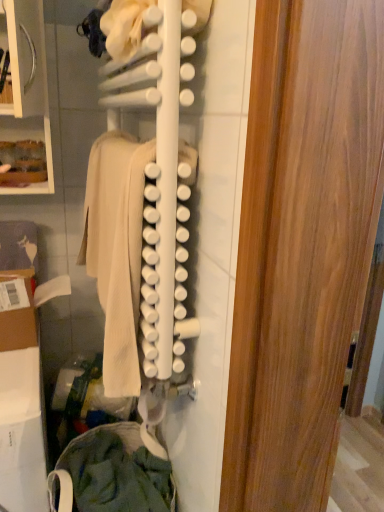
Question: Considering the positions of point (104, 170) and point (145, 461), is point (104, 170) closer or farther from the camera than point (145, 461)?

Choices:
 (A) closer
 (B) farther

Answer: (A)

Question: From a real-world perspective, relative to green cotton pants at lower left, the second clothing from the top, is white matte rack at center vertically above or below?

Choices:
 (A) below
 (B) above

Answer: (B)

Question: Which of these objects is positioned farthest from the green cotton pants at lower left, the first clothing ordered from the bottom?

Choices:
 (A) white matte rack at center
 (B) beige wool sweater at center, which ranks as the second clothing in bottom-to-top order

Answer: (A)

Question: Estimate the real-world distances between objects in this image. Which object is closer to the beige wool sweater at center, which ranks as the second clothing in bottom-to-top order?

Choices:
 (A) white matte rack at center
 (B) green cotton pants at lower left, the first clothing ordered from the bottom

Answer: (A)